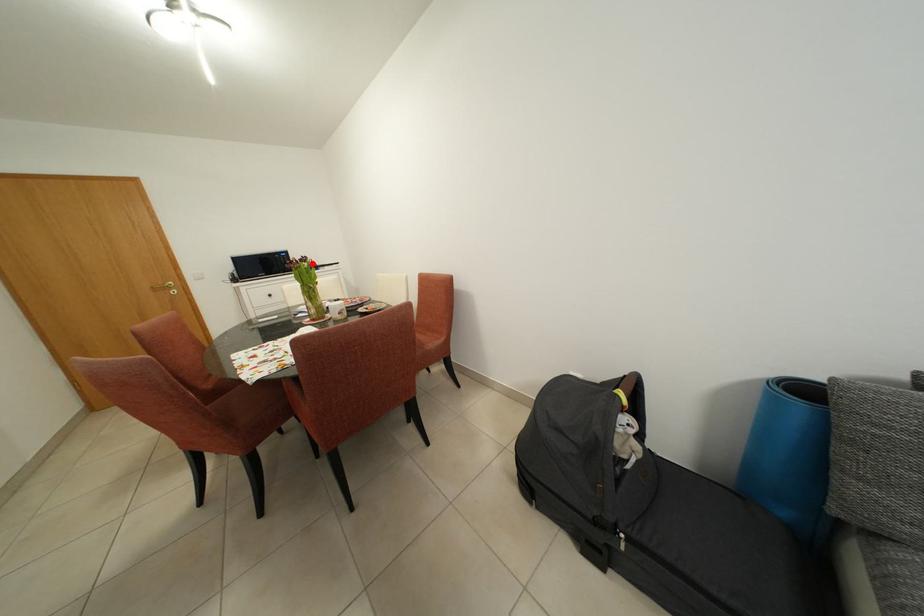
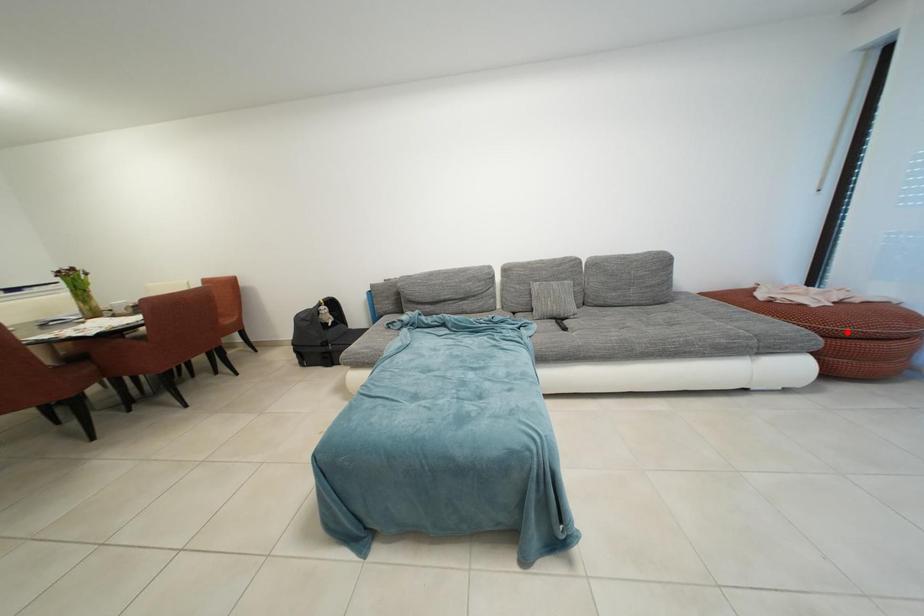
I am providing you with two images of the same scene from different viewpoints. A red point is marked on the first image and another point is marked on the second image. Do the highlighted points in image1 and image2 indicate the same real-world spot?

No